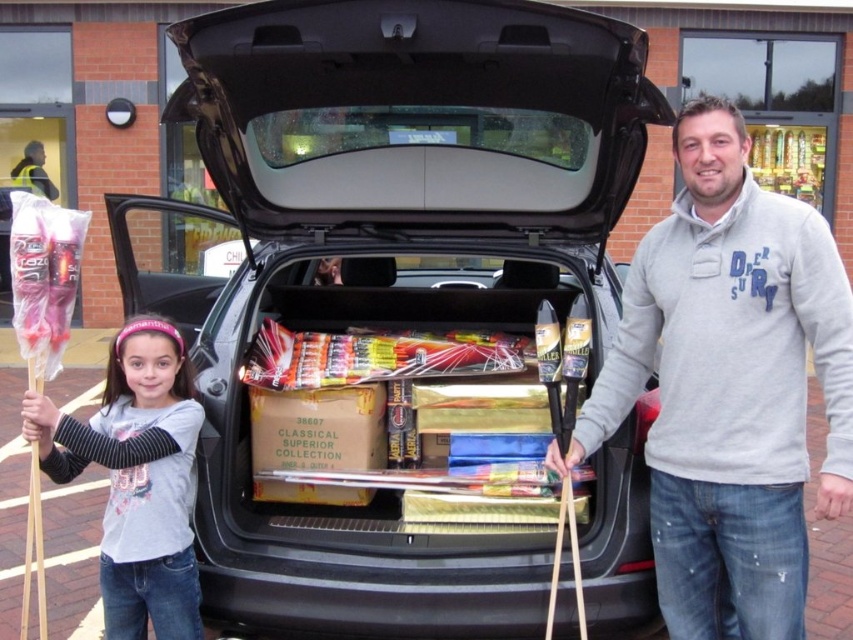
Question: Does gray fleece sweater at center lie behind gray cotton shirt at lower left?

Choices:
 (A) no
 (B) yes

Answer: (A)

Question: Which object is positioned farthest from the gray cotton shirt at lower left?

Choices:
 (A) gray fleece sweater at center
 (B) black matte car trunk at center

Answer: (A)

Question: Is black matte car trunk at center above gray fleece sweater at center?

Choices:
 (A) yes
 (B) no

Answer: (A)

Question: Which object is closer to the camera taking this photo?

Choices:
 (A) black matte car trunk at center
 (B) gray cotton shirt at lower left

Answer: (A)

Question: Which object appears farthest from the camera in this image?

Choices:
 (A) black matte car trunk at center
 (B) gray fleece sweater at center
 (C) gray cotton shirt at lower left

Answer: (C)

Question: Does black matte car trunk at center appear on the right side of gray cotton shirt at lower left?

Choices:
 (A) yes
 (B) no

Answer: (A)